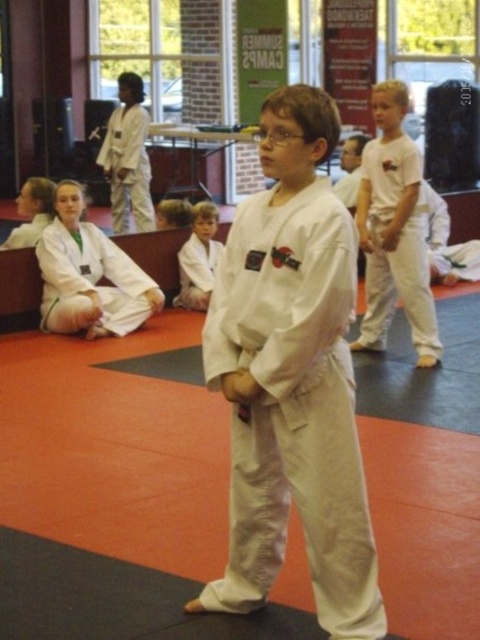
Between white cotton karate uniform at center and white cotton karate gi at center, which one has more height?

Standing taller between the two is white cotton karate uniform at center.

Between white cotton karate uniform at center and white cotton karate gi at center, which one appears on the right side from the viewer's perspective?

Positioned to the right is white cotton karate uniform at center.

Describe the element at coordinates (394, 230) in the screenshot. This screenshot has height=640, width=480. I see `white cotton karate uniform at center` at that location.

Locate an element on the screen. The height and width of the screenshot is (640, 480). white cotton karate uniform at center is located at coordinates (394, 230).